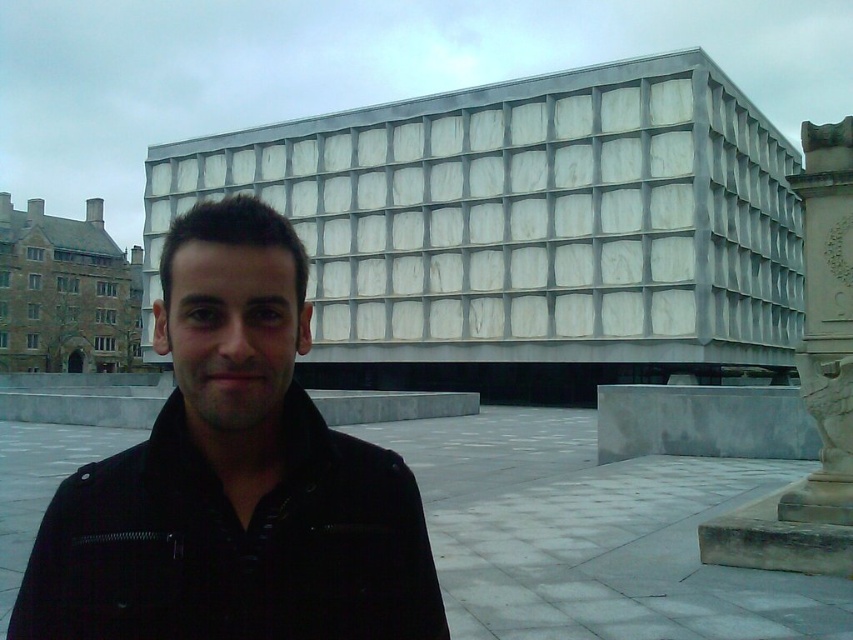
Question: Is black leather jacket at center below white stone column at right?

Choices:
 (A) no
 (B) yes

Answer: (B)

Question: Is the position of black leather jacket at center more distant than that of white stone column at right?

Choices:
 (A) yes
 (B) no

Answer: (B)

Question: Is black leather jacket at center to the left of white stone column at right from the viewer's perspective?

Choices:
 (A) yes
 (B) no

Answer: (A)

Question: Which object is farther from the camera taking this photo?

Choices:
 (A) white stone column at right
 (B) black leather jacket at center

Answer: (A)